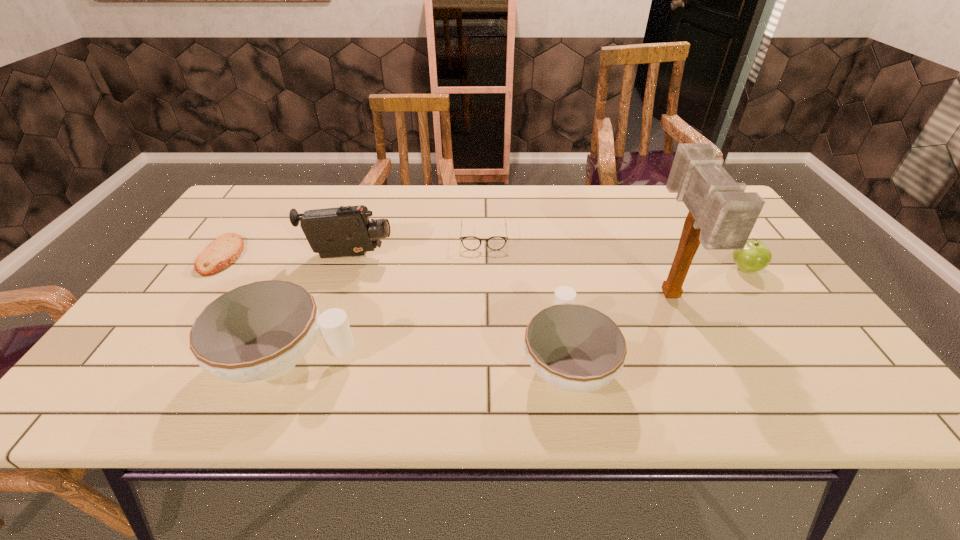
At what (x,y) coordinates should I click in order to perform the action: click on mallet. Please return your answer as a coordinate pair (x, y). This screenshot has width=960, height=540. Looking at the image, I should click on (721, 216).

Locate an element on the screen. This screenshot has height=540, width=960. the sixth object from left to right is located at coordinates (721, 216).

Where is `free point located on the side with the handle of the fifth shortest object`? free point located on the side with the handle of the fifth shortest object is located at coordinates (497, 360).

You are a GUI agent. You are given a task and a screenshot of the screen. Output one action in this format:
    pyautogui.click(x=<x>, y=<y>)
    Task: Click on the free point located 0.130m on the side with the handle of the right chinaware
    Image resolution: width=960 pixels, height=540 pixels.
    Given the screenshot: What is the action you would take?
    pyautogui.click(x=552, y=282)

The height and width of the screenshot is (540, 960). What are the coordinates of `free region located 0.080m on the side with the handle of the right chinaware` in the screenshot? It's located at (555, 296).

You are a GUI agent. You are given a task and a screenshot of the screen. Output one action in this format:
    pyautogui.click(x=<x>, y=<y>)
    Task: Click on the vacant point located on the side with the handle of the right chinaware
    
    Given the screenshot: What is the action you would take?
    pyautogui.click(x=553, y=285)

You are a GUI agent. You are given a task and a screenshot of the screen. Output one action in this format:
    pyautogui.click(x=<x>, y=<y>)
    Task: Click on the vacant space situated through the lenses of the fourth object from left to right
    
    Given the screenshot: What is the action you would take?
    pyautogui.click(x=484, y=262)

Locate an element on the screen. vacant space located 0.360m on the front-facing side of the camcorder is located at coordinates (524, 256).

I want to click on free spot located on the back of the apple, so click(689, 190).

Where is `free location located 0.130m on the right of the shortest object`? free location located 0.130m on the right of the shortest object is located at coordinates (288, 255).